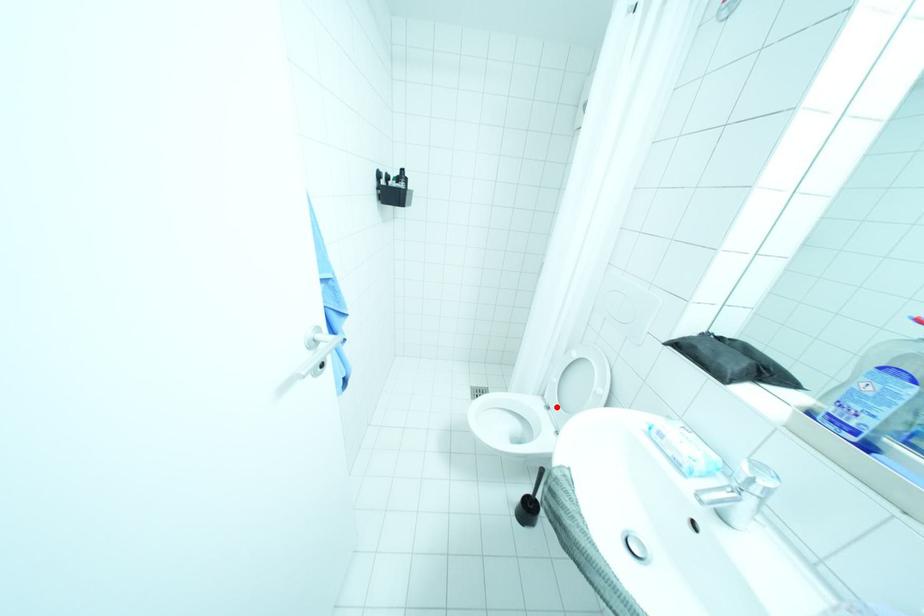
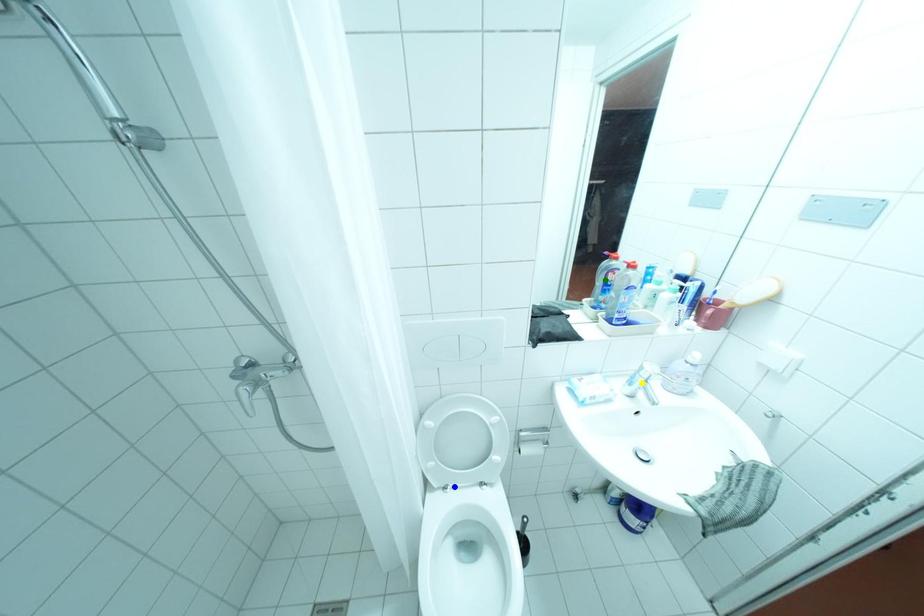
Question: I am providing you with two images of the same scene from different viewpoints. A red point is marked on the first image. You are given multiple points on the second image. Which point in image 2 represents the same 3d spot as the red point in image 1?

Choices:
 (A) green point
 (B) blue point
 (C) yellow point

Answer: (B)